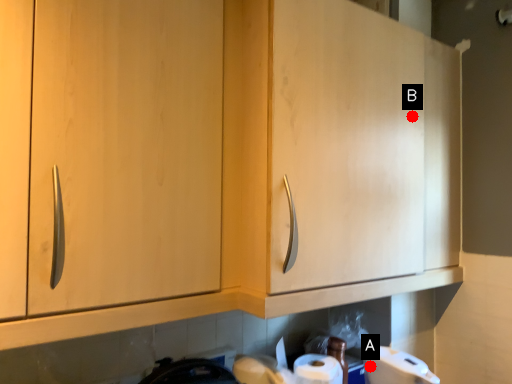
Question: Two points are circled on the image, labeled by A and B beside each circle. Which point is farther to the camera?

Choices:
 (A) A is further
 (B) B is further

Answer: (B)